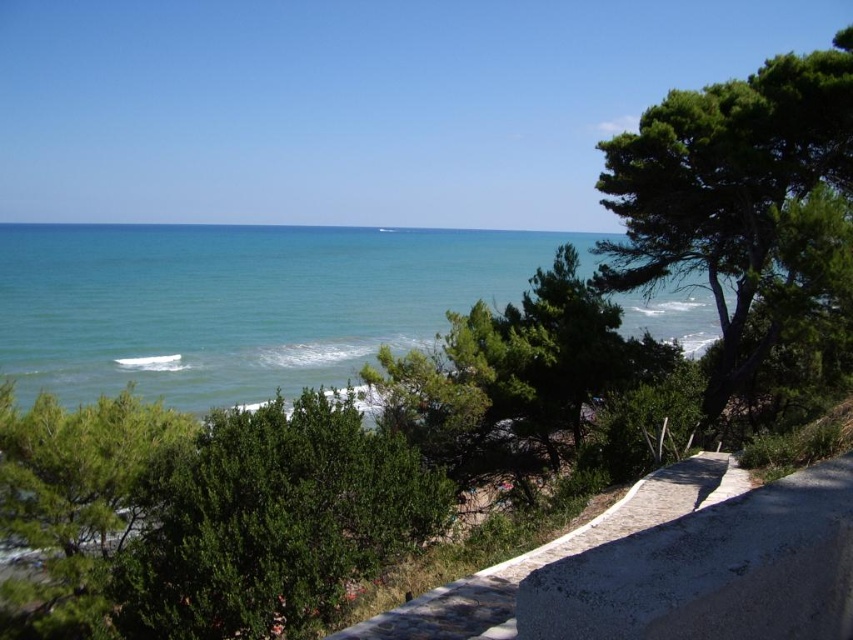
You are a photographer standing on the stone pathway and want to take a photo of the blue water at center and the green leafy bush at center. Which object is closer to your camera lens?

The blue water at center is closer to the camera lens because it is further to the viewer than the green leafy bush at center, meaning it appears nearer in the scene.

You are a photographer planning to capture a wide landscape shot of the coastal scene. Your camera can only focus on objects within a 100 cm width. You see the blue water at center and the green textured tree at right. Which object should you prioritize to ensure it fits entirely within your camera frame?

The blue water at center might be wider than green textured tree at right. Since the camera can focus on objects within 100 cm width, prioritize capturing the green textured tree at right first, as it is likely narrower and more likely to fit within the frame.

You are a landscape designer planning to install a new pathway in the coastal area shown. You notice the blue water at center and the green leafy bush at center. Which object is positioned higher in the scene?

The blue water at center is located above the green leafy bush at center, so the blue water at center is positioned higher in the scene.